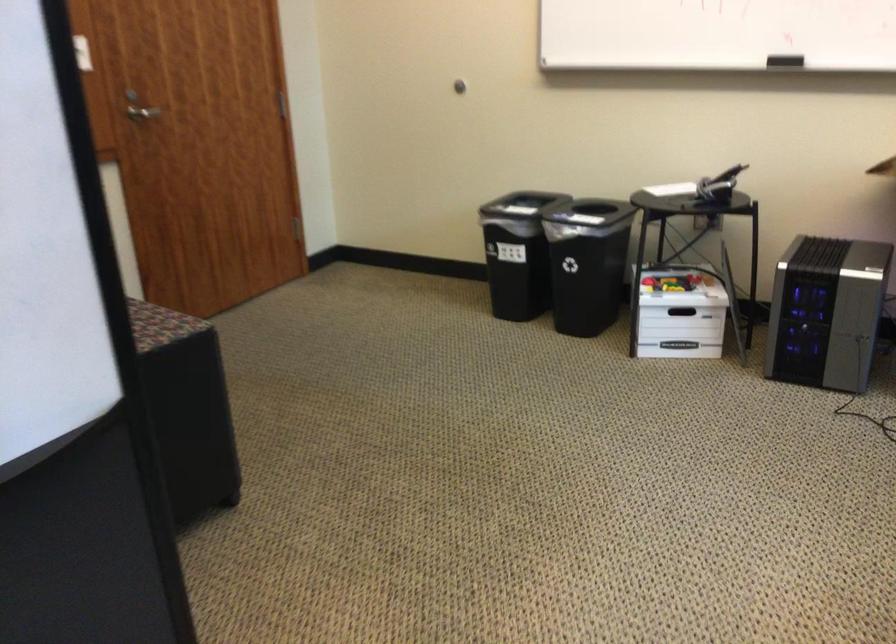
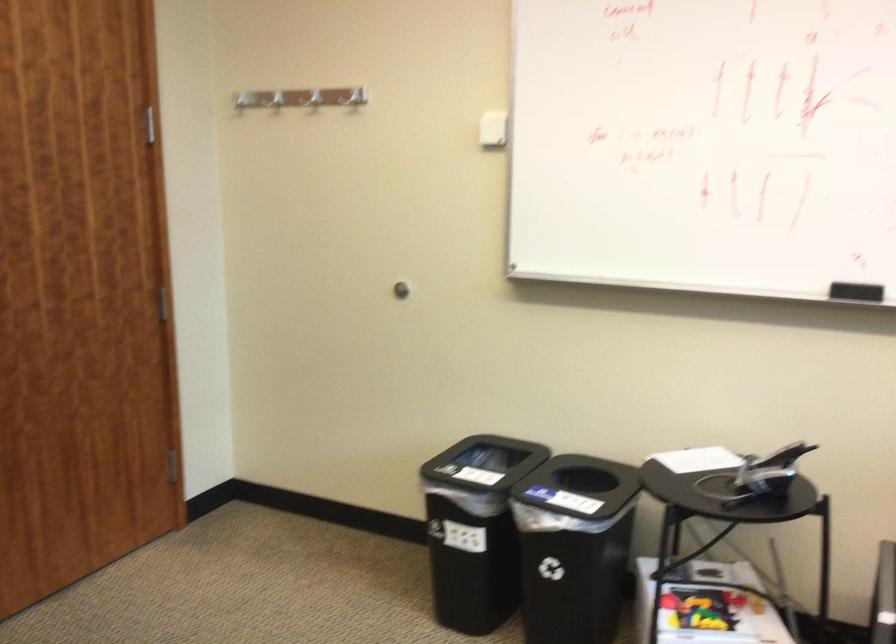
In the second image, find the point that corresponds to [668,285] in the first image.

(701, 609)